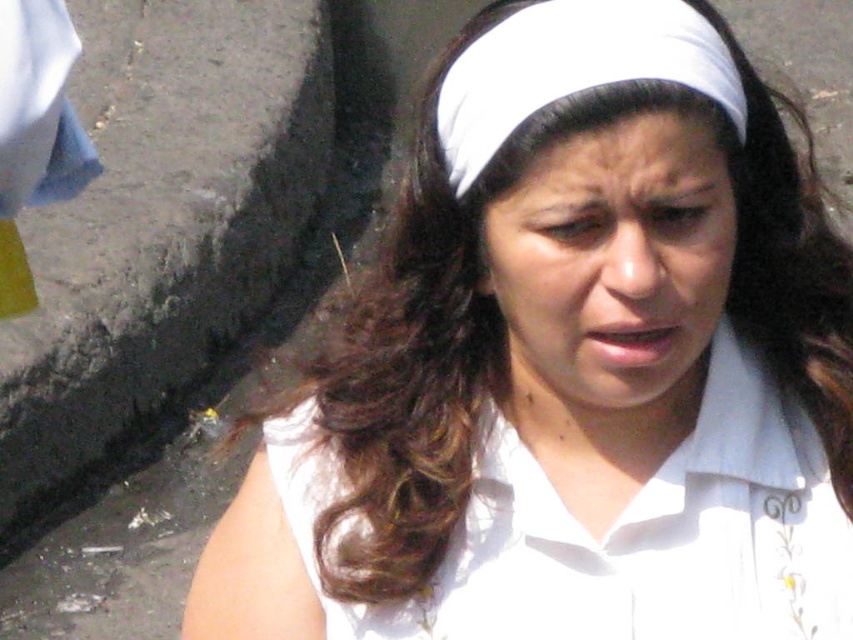
You are a photographer trying to capture a candid shot of the scene. You notice the asphalt at lower left and the white cotton shirt at center. Which object occupies more horizontal space in the image?

The asphalt at lower left occupies more horizontal space than the white cotton shirt at center because its width is larger.